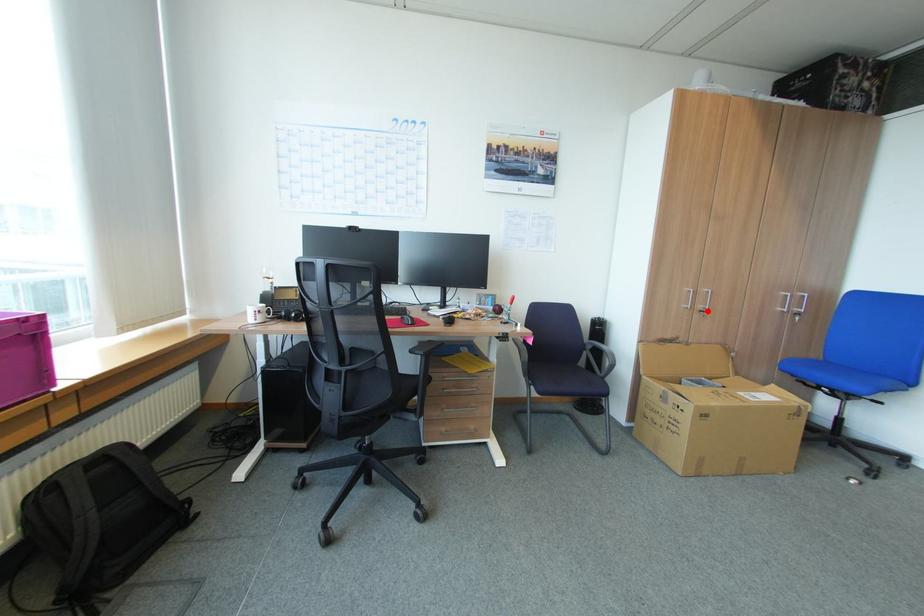
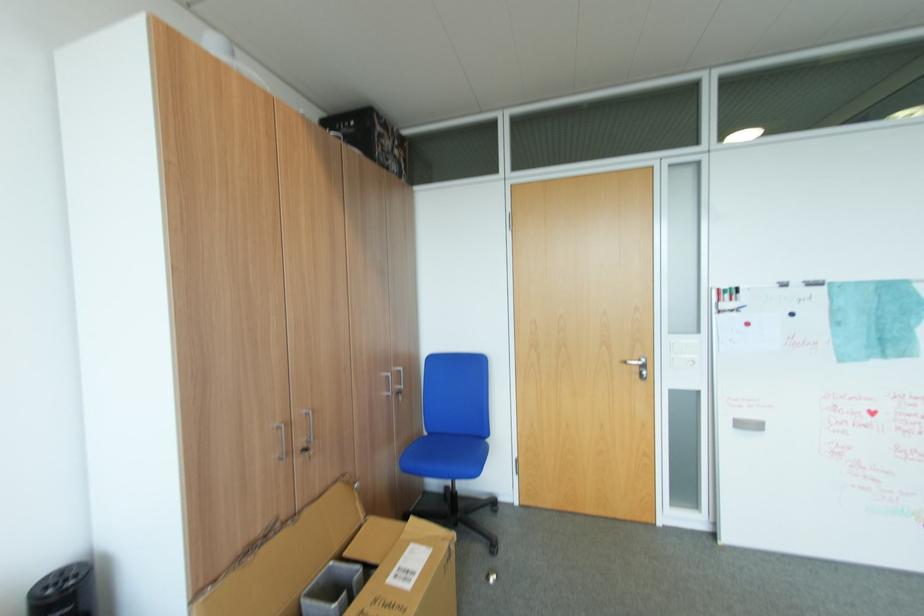
Find the pixel in the second image that matches the highlighted location in the first image.

(310, 451)